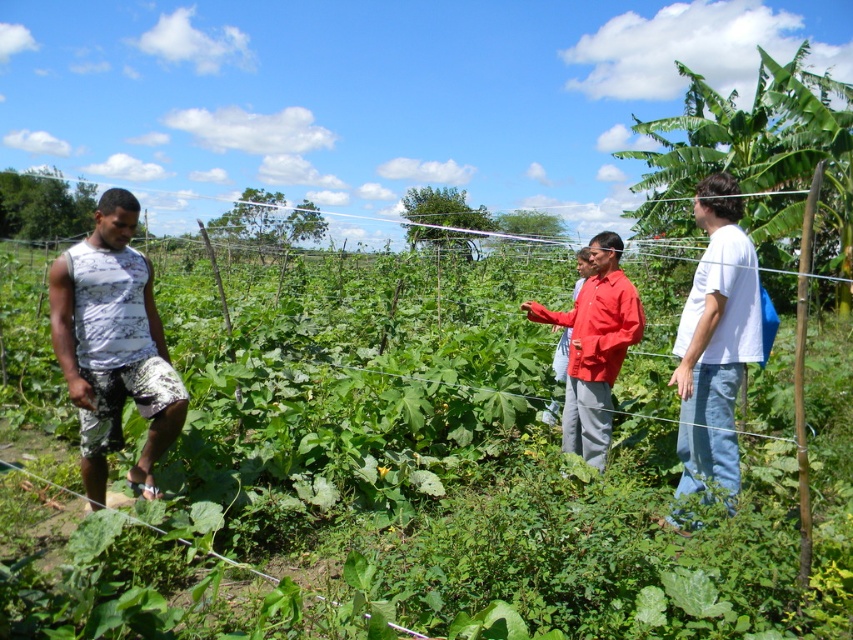
Question: Which object appears farthest from the camera in this image?

Choices:
 (A) white cotton shirt at right
 (B) matte red shirt at center
 (C) white printed tank top at left

Answer: (B)

Question: Does white printed tank top at left lie in front of matte red shirt at center?

Choices:
 (A) yes
 (B) no

Answer: (A)

Question: Which point is closer to the camera?

Choices:
 (A) (753, 307)
 (B) (553, 353)
 (C) (70, 570)
 (D) (111, 424)

Answer: (C)

Question: From the image, what is the correct spatial relationship of white printed tank top at left in relation to white cotton shirt at right?

Choices:
 (A) left
 (B) right

Answer: (A)

Question: Estimate the real-world distances between objects in this image. Which object is farther from the red matte shirt at center?

Choices:
 (A) green leafy plant at center
 (B) white cotton shirt at right

Answer: (A)

Question: Can you confirm if white printed tank top at left is positioned above red matte shirt at center?

Choices:
 (A) no
 (B) yes

Answer: (A)